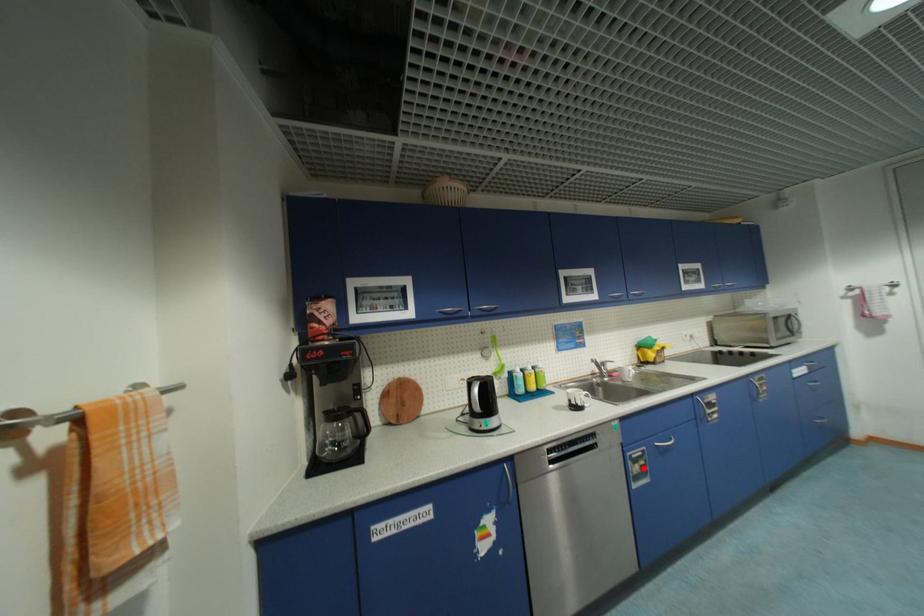
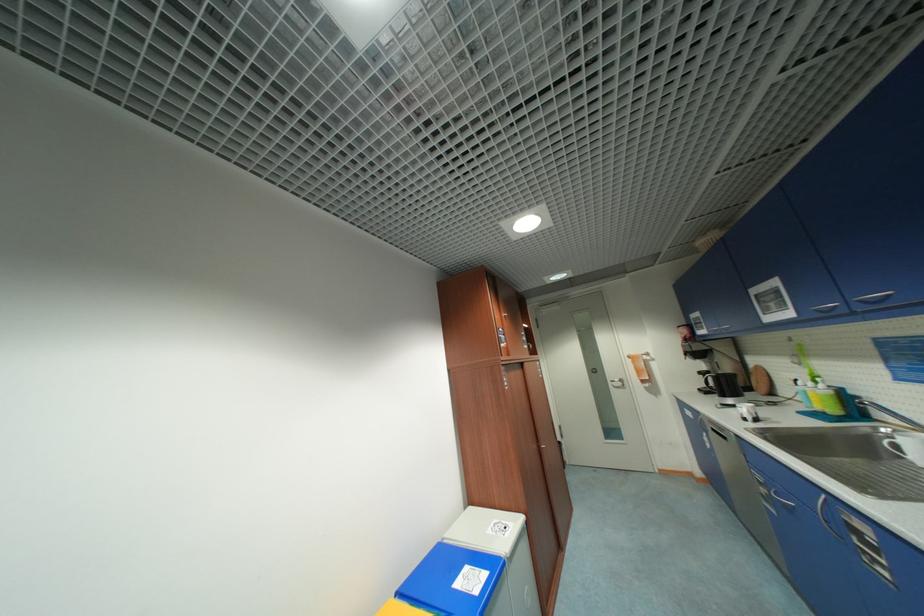
The point at the highlighted location is marked in the first image. Where is the corresponding point in the second image?

(768, 491)